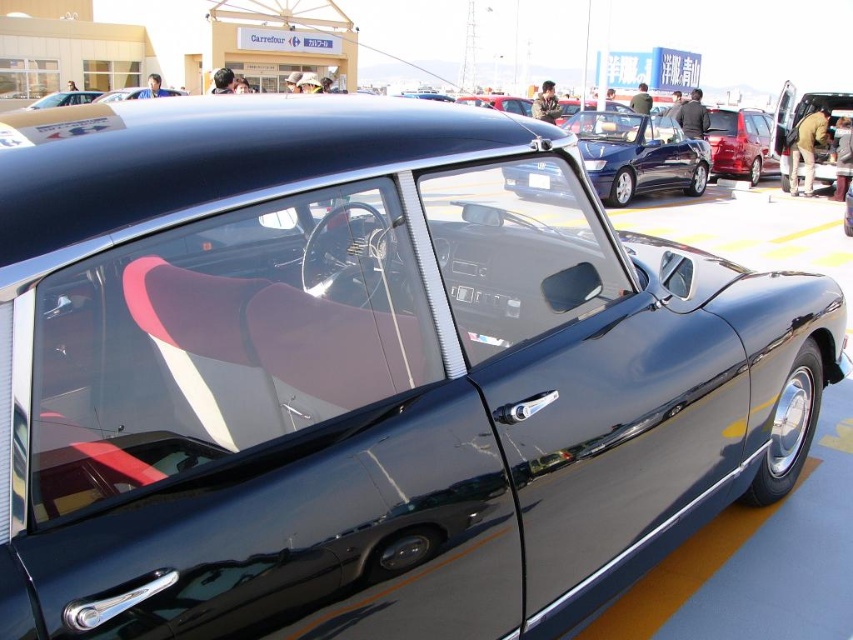
Is matte black car at upper left to the left of black plastic license plate at center from the viewer's perspective?

Yes, matte black car at upper left is to the left of black plastic license plate at center.

Is point (77, 102) less distant than point (537, 182)?

No, (77, 102) is further to viewer.

The height and width of the screenshot is (640, 853). I want to click on matte black car at upper left, so click(x=64, y=99).

Is glossy black sedan at center bigger than matte black car at upper left?

No.

Is glossy black sedan at center positioned in front of matte black car at upper left?

Yes.

The width and height of the screenshot is (853, 640). I want to click on glossy black sedan at center, so click(x=637, y=156).

Which is above, glossy black sedan at center or black plastic license plate at center?

Positioned higher is glossy black sedan at center.

Is point (654, 186) positioned in front of point (538, 170)?

No, it is not.

Does point (604, 118) come behind point (543, 186)?

Yes.

Find the location of a particular element. glossy black sedan at center is located at coordinates (637, 156).